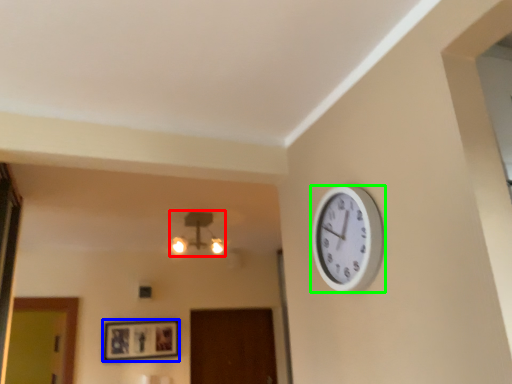
Question: Which object is positioned closest to lamp (highlighted by a red box)? Select from picture frame (highlighted by a blue box) and wall clock (highlighted by a green box).

Choices:
 (A) picture frame
 (B) wall clock

Answer: (A)